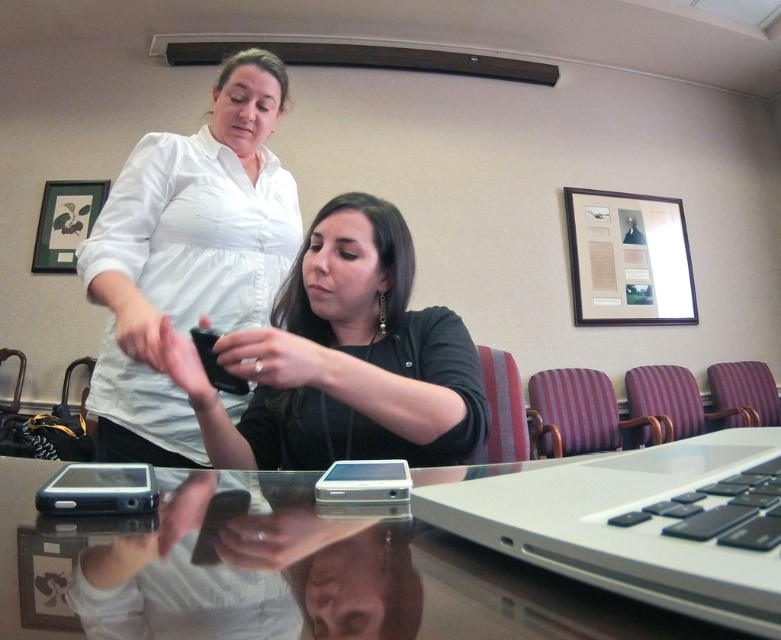
The image size is (781, 640). What do you see at coordinates (280, 573) in the screenshot?
I see `transparent glass table at center` at bounding box center [280, 573].

In the scene shown: Does transparent glass table at center appear under white matte shirt at upper left?

Yes.

Between point (398, 595) and point (95, 300), which one is positioned behind?

Point (95, 300)

This screenshot has height=640, width=781. What are the coordinates of `transparent glass table at center` in the screenshot? It's located at (280, 573).

Between silver metallic laptop at lower right and black matte phone at lower left, which one is positioned lower?

black matte phone at lower left

Does point (719, 492) come farther from viewer compared to point (54, 500)?

No.

Locate an element on the screen. The height and width of the screenshot is (640, 781). silver metallic laptop at lower right is located at coordinates (642, 524).

Does transparent glass table at center appear on the right side of black matte phone at center?

Yes, transparent glass table at center is to the right of black matte phone at center.

From the picture: Who is higher up, transparent glass table at center or black matte phone at center?

black matte phone at center is higher up.

Measure the distance between transparent glass table at center and camera.

transparent glass table at center is 24.91 centimeters away from camera.

Find the location of a particular element. This screenshot has width=781, height=640. transparent glass table at center is located at coordinates (280, 573).